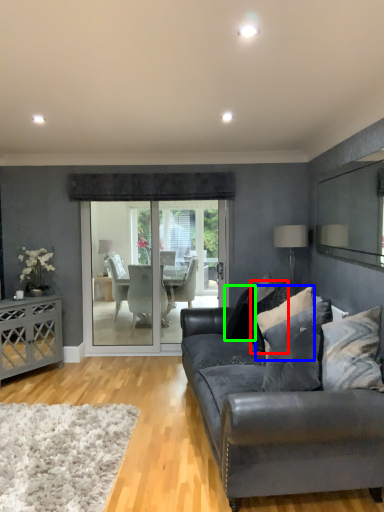
Question: Which is nearer to the pillow (highlighted by a red box)? pillow (highlighted by a blue box) or pillow (highlighted by a green box).

Choices:
 (A) pillow
 (B) pillow

Answer: (B)